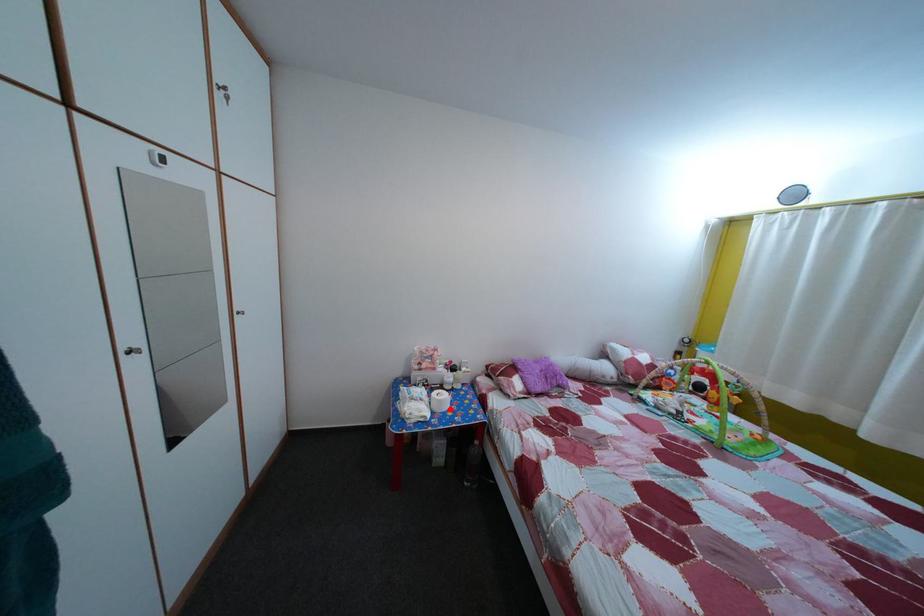
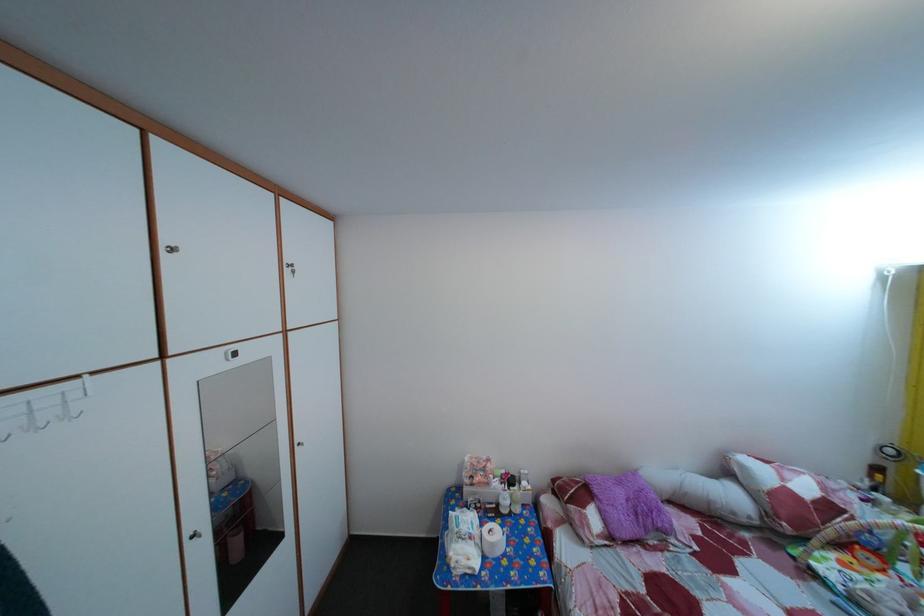
Find the pixel in the second image that matches the highlighted location in the first image.

(502, 553)